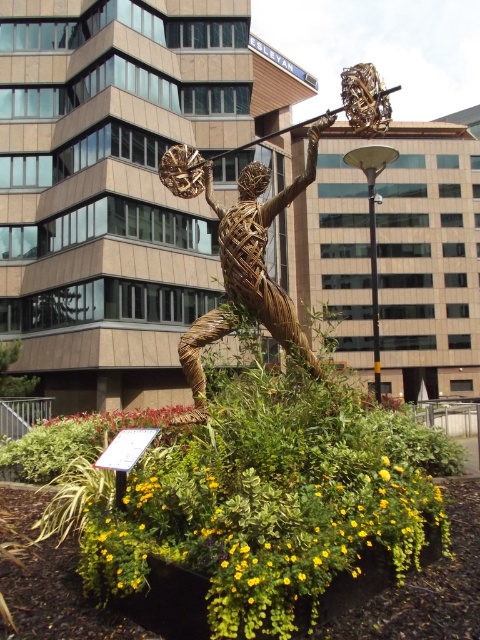
You are a city planner assessing the sculpture for a new public space. You need to ensure that the braided wicker figure at center and the black metal pole at center are spaced appropriately for safety. Based on their widths, which object should be placed closer to a busy sidewalk to minimize obstruction?

The braided wicker figure at center has a lesser width compared to the black metal pole at center. Therefore, the braided wicker figure at center should be placed closer to the busy sidewalk since it takes up less space and would obstruct the path less than the wider black metal pole at center.

You are a photographer standing at the base of the sculpture. You want to take a photo that includes both the braided wicker figure at center and the black metal pole at center. Which object should you focus on first to ensure both are in the frame?

You should focus on the braided wicker figure at center first because it is closer to the viewer than the black metal pole at center, so adjusting the focus from near to far will help capture both in the frame.